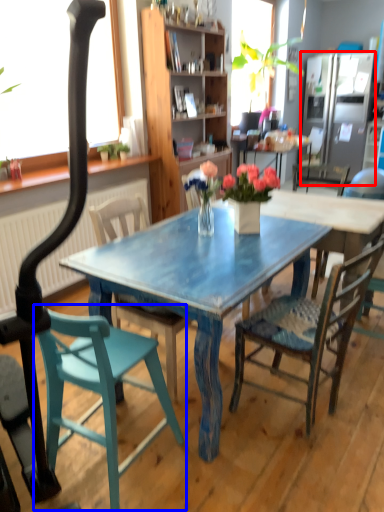
Question: Which object appears farthest to the camera in this image, refrigerator (highlighted by a red box) or chair (highlighted by a blue box)?

Choices:
 (A) refrigerator
 (B) chair

Answer: (A)